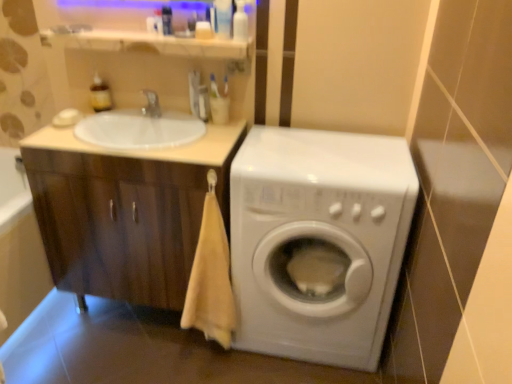
Question: Are white matte soap at upper left, which is the second soap in bottom-to-top order, and translucent plastic bottle at upper center, marked as the fifth toiletry in a left-to-right arrangement, far apart?

Choices:
 (A) yes
 (B) no

Answer: (B)

Question: Is translucent plastic bottle at upper center, the second toiletry positioned from the right, at the back of white matte soap at upper left, which is the second soap in bottom-to-top order?

Choices:
 (A) no
 (B) yes

Answer: (A)

Question: Is white matte soap at upper left, the first soap when ordered from top to bottom, completely or partially outside of translucent plastic bottle at upper center, marked as the fifth toiletry in a left-to-right arrangement?

Choices:
 (A) no
 (B) yes

Answer: (B)

Question: Is white matte soap at upper left, which is the second soap in bottom-to-top order, bigger than translucent plastic bottle at upper center, the second toiletry positioned from the right?

Choices:
 (A) no
 (B) yes

Answer: (A)

Question: Considering the relative sizes of white matte soap at upper left, which is the second soap in bottom-to-top order, and translucent plastic bottle at upper center, marked as the fifth toiletry in a left-to-right arrangement, in the image provided, is white matte soap at upper left, which is the second soap in bottom-to-top order, shorter than translucent plastic bottle at upper center, marked as the fifth toiletry in a left-to-right arrangement,?

Choices:
 (A) yes
 (B) no

Answer: (A)

Question: Is white matte soap at upper left, the first soap when ordered from top to bottom, next to translucent plastic bottle at upper center, the second toiletry positioned from the right?

Choices:
 (A) yes
 (B) no

Answer: (B)

Question: Is white glossy sink at upper left placed right next to beige cotton towel at lower left?

Choices:
 (A) no
 (B) yes

Answer: (A)

Question: From a real-world perspective, does white glossy sink at upper left stand above beige cotton towel at lower left?

Choices:
 (A) yes
 (B) no

Answer: (A)

Question: Does white glossy sink at upper left have a larger size compared to beige cotton towel at lower left?

Choices:
 (A) no
 (B) yes

Answer: (B)

Question: Could you tell me if white glossy sink at upper left is turned towards beige cotton towel at lower left?

Choices:
 (A) yes
 (B) no

Answer: (B)

Question: Is white glossy sink at upper left smaller than beige cotton towel at lower left?

Choices:
 (A) no
 (B) yes

Answer: (A)

Question: Is white glossy sink at upper left outside beige cotton towel at lower left?

Choices:
 (A) yes
 (B) no

Answer: (A)

Question: From the image's perspective, is translucent plastic bottle at upper center, the second toiletry positioned from the right, located beneath transparent plastic bottle at upper center, acting as the 6th toiletry starting from the left?

Choices:
 (A) no
 (B) yes

Answer: (A)